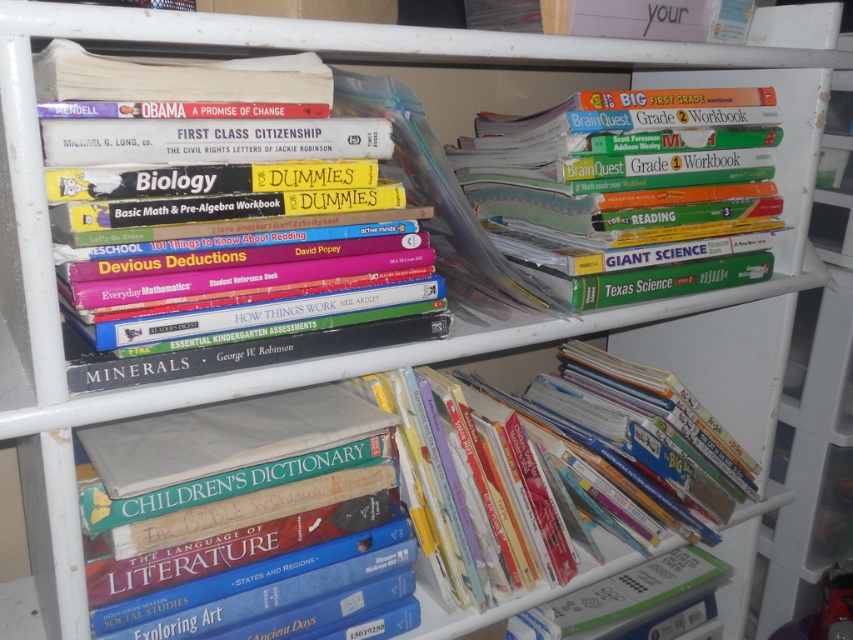
Is point (219, 124) farther from camera compared to point (703, 506)?

No, (219, 124) is in front of (703, 506).

Between hardcover book at upper left and hardcover books at center, which one appears on the right side from the viewer's perspective?

From the viewer's perspective, hardcover books at center appears more on the right side.

Find the location of a particular element. The height and width of the screenshot is (640, 853). hardcover book at upper left is located at coordinates (199, 154).

Which is below, hardcover workbook at upper right or hardcover book at lower right?

hardcover book at lower right is below.

The width and height of the screenshot is (853, 640). What are the coordinates of `hardcover workbook at upper right` in the screenshot? It's located at (625, 179).

Which is below, hardcover book at upper left or hardcover book at lower right?

hardcover book at lower right is lower down.

Can you confirm if hardcover book at upper left is bigger than hardcover book at lower right?

Correct, hardcover book at upper left is larger in size than hardcover book at lower right.

Is point (386, 125) positioned after point (624, 576)?

No.

Find the location of a particular element. hardcover book at upper left is located at coordinates (199, 154).